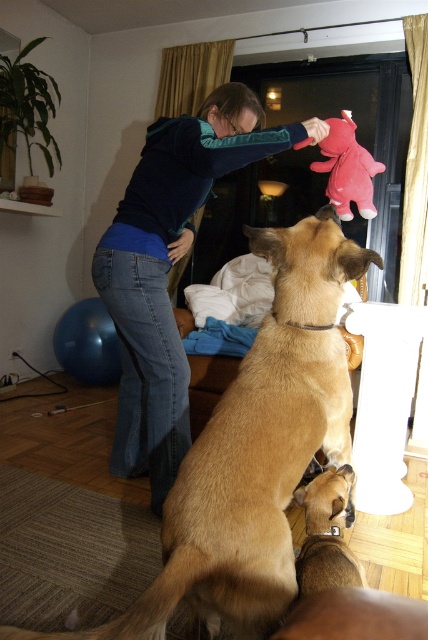
Which is more to the right, brown furry dog at center or blue fleece sweater at upper center?

brown furry dog at center

Who is taller, brown furry dog at center or blue fleece sweater at upper center?

blue fleece sweater at upper center

Which is behind, point (344, 364) or point (148, 346)?

Point (148, 346)

Locate an element on the screen. Image resolution: width=428 pixels, height=640 pixels. brown furry dog at center is located at coordinates (255, 449).

Between blue fleece sweater at upper center and brown fur dog at center, which one has more height?

With more height is blue fleece sweater at upper center.

Between blue fleece sweater at upper center and brown fur dog at center, which one appears on the left side from the viewer's perspective?

blue fleece sweater at upper center is more to the left.

At what (x,y) coordinates should I click in order to perform the action: click on blue fleece sweater at upper center. Please return your answer as a coordinate pair (x, y). Looking at the image, I should click on (169, 268).

Between point (246, 552) and point (363, 154), which one is positioned in front?

Point (246, 552) is in front.

Is the position of brown furry dog at center less distant than that of pink plush elephant at upper center?

Yes.

Describe the element at coordinates (255, 449) in the screenshot. The image size is (428, 640). I see `brown furry dog at center` at that location.

This screenshot has height=640, width=428. Find the location of `brown furry dog at center`. brown furry dog at center is located at coordinates (255, 449).